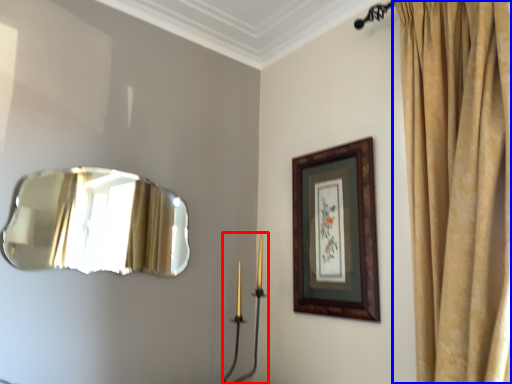
Question: Which object is further to the camera taking this photo, candle holder (highlighted by a red box) or curtain (highlighted by a blue box)?

Choices:
 (A) candle holder
 (B) curtain

Answer: (A)